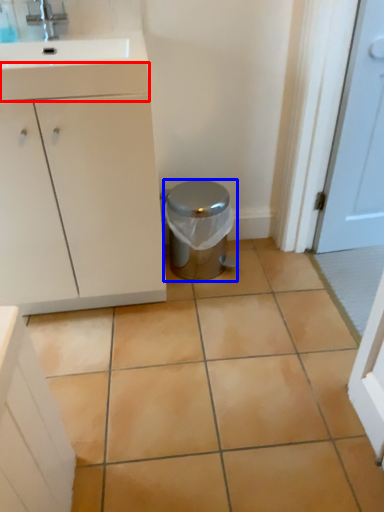
Question: Which object is closer to the camera taking this photo, drawer (highlighted by a red box) or potty (highlighted by a blue box)?

Choices:
 (A) drawer
 (B) potty

Answer: (A)